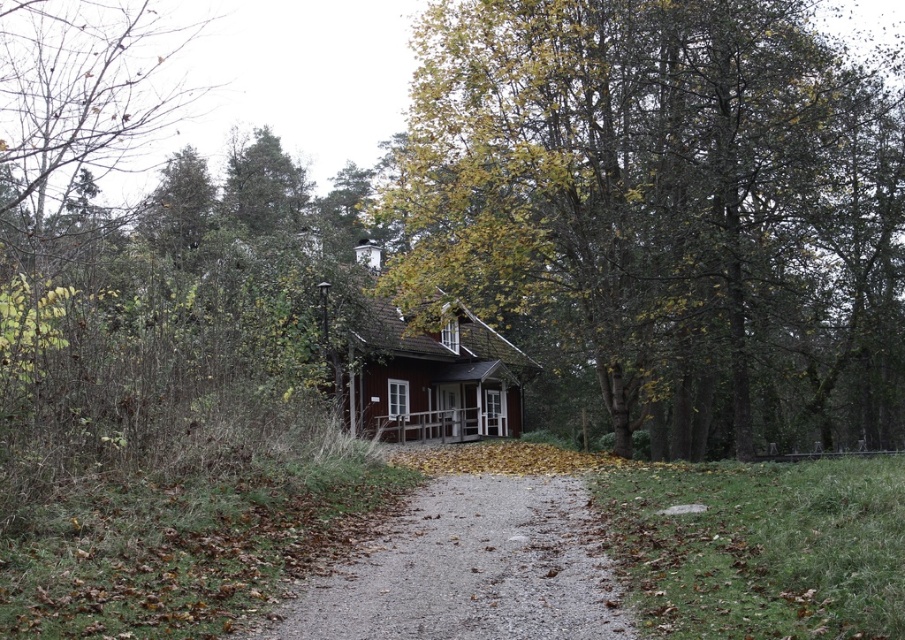
At what (x,y) coordinates should I click in order to perform the action: click on green leafy tree at center. Please return your answer as a coordinate pair (x, y). Image resolution: width=905 pixels, height=640 pixels. Looking at the image, I should click on (665, 209).

Between green leafy tree at center and gray gravel path at center, which one is positioned lower?

Positioned lower is gray gravel path at center.

Is point (732, 104) positioned in front of point (286, 612)?

No, it is not.

Identify the location of green leafy tree at center. (665, 209).

Which is more to the right, green leafy tree at center or wooden cottage at center?

Positioned to the right is green leafy tree at center.

Can you confirm if green leafy tree at center is positioned below wooden cottage at center?

Actually, green leafy tree at center is above wooden cottage at center.

Describe the element at coordinates (665, 209) in the screenshot. The width and height of the screenshot is (905, 640). I see `green leafy tree at center` at that location.

Find the location of a particular element. The height and width of the screenshot is (640, 905). green leafy tree at center is located at coordinates (665, 209).

What do you see at coordinates (472, 570) in the screenshot? The height and width of the screenshot is (640, 905). I see `gray gravel path at center` at bounding box center [472, 570].

Is gray gravel path at center above wooden cottage at center?

No, gray gravel path at center is not above wooden cottage at center.

The width and height of the screenshot is (905, 640). What do you see at coordinates (472, 570) in the screenshot?
I see `gray gravel path at center` at bounding box center [472, 570].

What are the coordinates of `gray gravel path at center` in the screenshot? It's located at (472, 570).